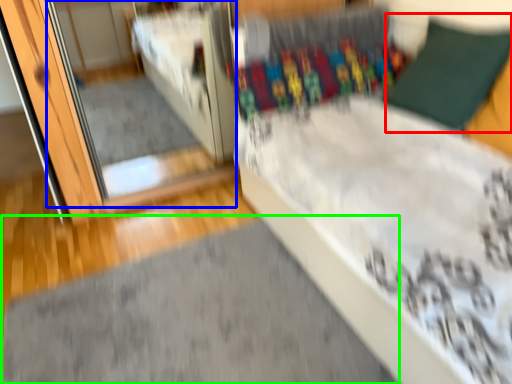
Question: Estimate the real-world distances between objects in this image. Which object is farther from pillow (highlighted by a red box), mirror (highlighted by a blue box) or doormat (highlighted by a green box)?

Choices:
 (A) mirror
 (B) doormat

Answer: (A)